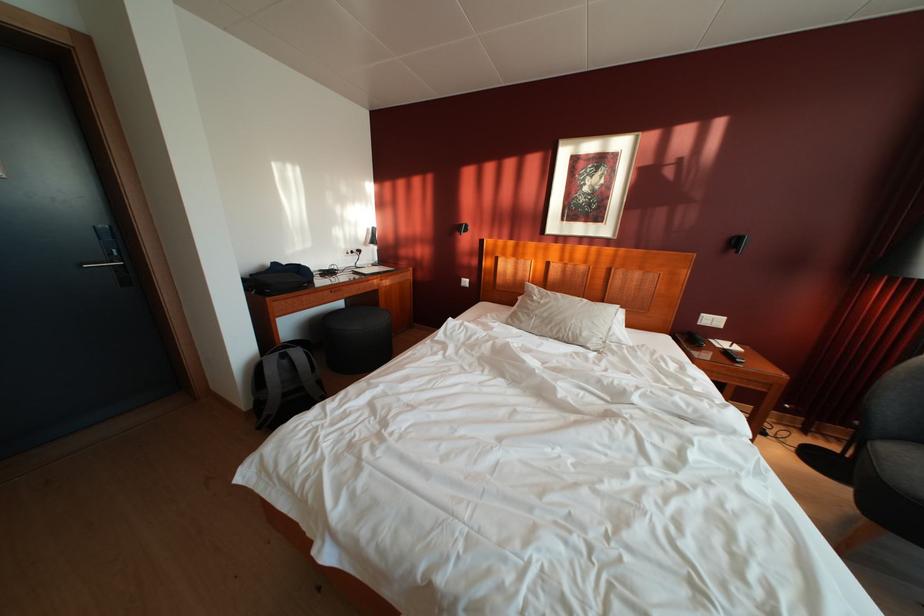
The height and width of the screenshot is (616, 924). Find the location of `gray and black backpack`. gray and black backpack is located at coordinates (285, 385).